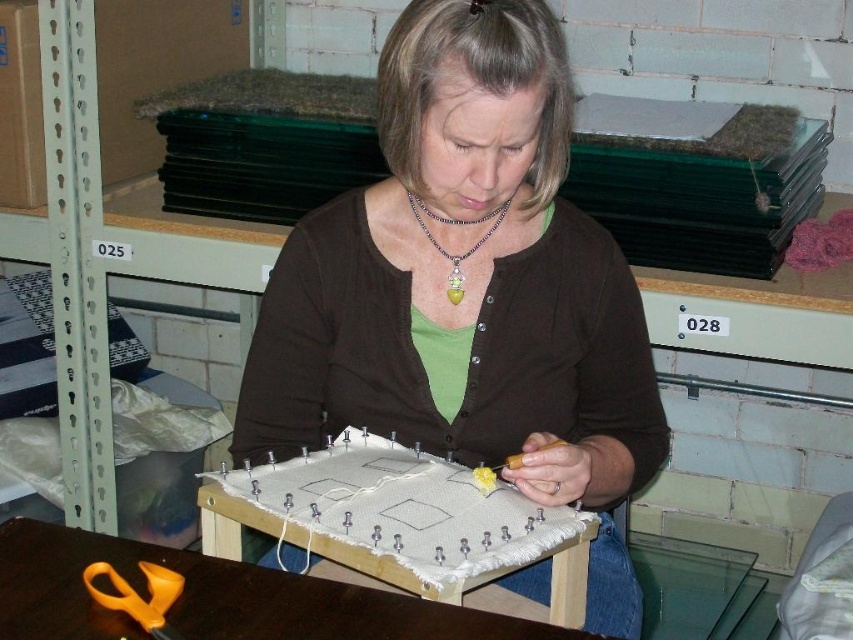
Question: Which of the following is the farthest from the observer?

Choices:
 (A) shiny silver necklace with green pendant at center
 (B) yellow plastic scissors at lower left
 (C) wooden table at lower center
 (D) brown matte sweater at center

Answer: (A)

Question: Does brown matte sweater at center come behind wooden table at lower center?

Choices:
 (A) no
 (B) yes

Answer: (B)

Question: Can you confirm if wooden table at lower center is positioned to the right of yellow plastic scissors at lower left?

Choices:
 (A) no
 (B) yes

Answer: (B)

Question: Which of the following is the farthest from the observer?

Choices:
 (A) (556, 300)
 (B) (167, 586)
 (C) (473, 248)

Answer: (C)

Question: Which point is farther to the camera?

Choices:
 (A) brown matte sweater at center
 (B) wooden table at lower center
 (C) yellow plastic scissors at lower left
 (D) shiny silver necklace with green pendant at center

Answer: (D)

Question: Is wooden table at lower center closer to the viewer compared to yellow plastic scissors at lower left?

Choices:
 (A) yes
 (B) no

Answer: (B)